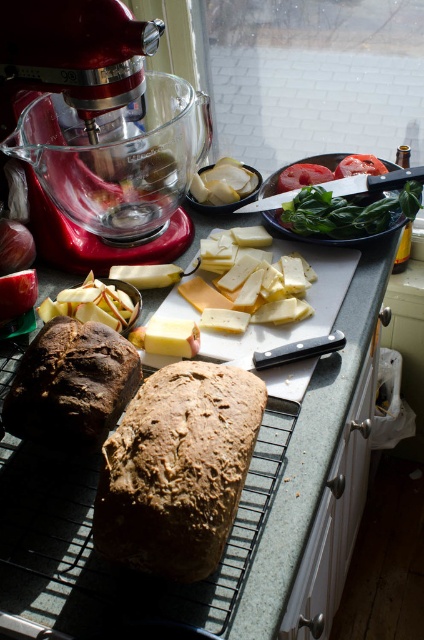
You are a baker preparing for a party and need to place the dark brown crusty loaf of bread at lower left and the metallic silver platter at center on a shelf. The shelf has limited height clearance. Which object should you place first to ensure both fit without exceeding the height limit?

The dark brown crusty loaf of bread at lower left is not as tall as the metallic silver platter at center, so you should place the metallic silver platter at center first to ensure there is enough space for the shorter loaf of bread afterward.

What is the spatial relationship between the dark brown crusty loaf of bread at lower left and the metallic silver platter at center?

The dark brown crusty loaf of bread at lower left is closer to the viewer than the metallic silver platter at center.

You are a baker preparing for a party and have both the brown rustic loaf at center and the metallic silver platter at center on your kitchen counter. If you need to clear space for a large bowl, which item should you remove to free up more area?

You should remove the metallic silver platter at center because it occupies more space than the brown rustic loaf at center, freeing up more area on the counter.